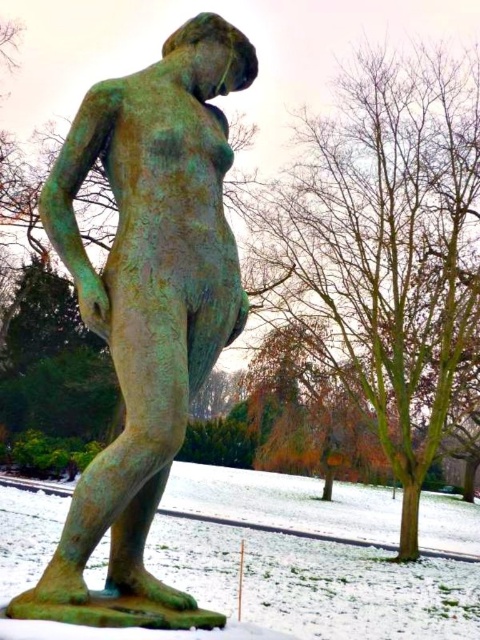
You are standing in the park and want to take a photo of the green patina bronze statue at center. The statue is represented by the point at coordinates (146, 307). If you are positioned at the point with coordinates 0.5, 0.5, which direction should you move to get closer to the statue?

The statue is located at point (146, 307), so if you are at 0.5, 0.5, you should move southwest to get closer to the statue.

You are standing in a winter park and see the green patina bronze statue at center. If you want to take a photo of it from the north side, which direction should you walk relative to the statue?

The green patina bronze statue at center is located at point (x=146, y=307). Since the statue is at the center of the coordinate system, you should walk north to position yourself directly north of it for the photo.

You are an artist planning to sketch the scene from the image. You need to ensure the proportions of the green patina bronze statue at center and the green patina snow at lower left are accurate. Based on the scene, which object should be drawn smaller in your sketch?

The green patina bronze statue at center should be drawn smaller because it is not as tall as the green patina snow at lower left.